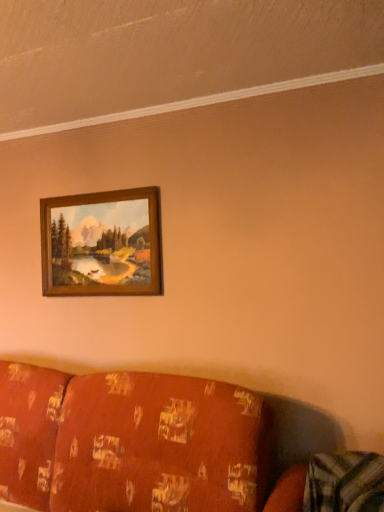
Question: From a real-world perspective, relative to patterned fabric couch at lower left, is wooden frame at upper center vertically above or below?

Choices:
 (A) below
 (B) above

Answer: (B)

Question: From the image's perspective, is wooden frame at upper center positioned above or below patterned fabric couch at lower left?

Choices:
 (A) below
 (B) above

Answer: (B)

Question: Is wooden frame at upper center wider or thinner than patterned fabric couch at lower left?

Choices:
 (A) thin
 (B) wide

Answer: (A)

Question: Considering the positions of patterned fabric couch at lower left and wooden frame at upper center in the image, is patterned fabric couch at lower left taller or shorter than wooden frame at upper center?

Choices:
 (A) short
 (B) tall

Answer: (B)

Question: Is point (96, 482) closer or farther from the camera than point (145, 286)?

Choices:
 (A) closer
 (B) farther

Answer: (A)

Question: Visually, is patterned fabric couch at lower left positioned to the left or to the right of wooden frame at upper center?

Choices:
 (A) left
 (B) right

Answer: (B)

Question: Is patterned fabric couch at lower left situated inside wooden frame at upper center or outside?

Choices:
 (A) outside
 (B) inside

Answer: (A)